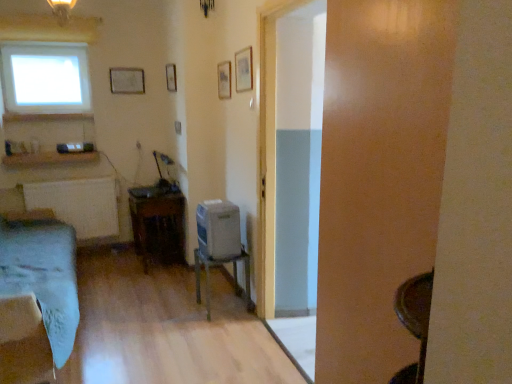
This screenshot has height=384, width=512. I want to click on vacant region under metallic gray table at center, which is the 1th table in right-to-left order (from a real-world perspective), so click(225, 306).